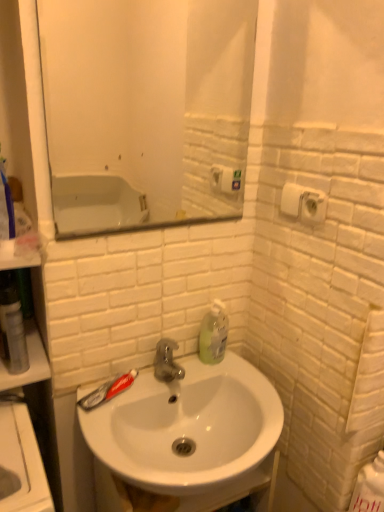
The image size is (384, 512). Find the location of `free space in front of translucent plastic soap dispenser at upper right`. free space in front of translucent plastic soap dispenser at upper right is located at coordinates (241, 383).